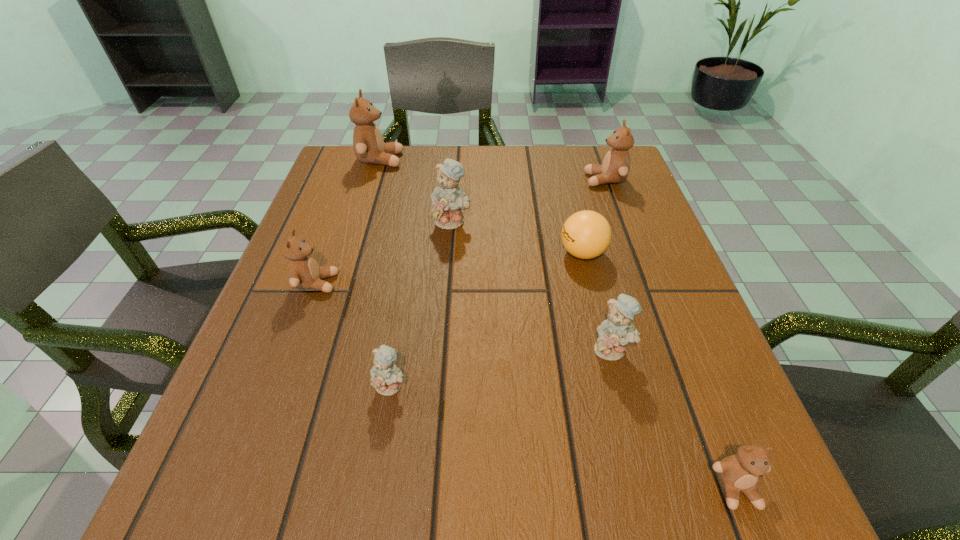
Identify which brown teddy bear is the second nearest to the second nearest brown teddy bear. Please provide its 2D coordinates. Your answer should be formatted as a tuple, i.e. [(x, y)], where the tuple contains the x and y coordinates of a point satisfying the conditions above.

[(615, 168)]

Where is `blue teddy bear that is the third closest to the third smallest brown teddy bear`? This screenshot has width=960, height=540. blue teddy bear that is the third closest to the third smallest brown teddy bear is located at coordinates (386, 377).

Where is `blue teddy bear that is the closest to the rightmost blue teddy bear`? This screenshot has height=540, width=960. blue teddy bear that is the closest to the rightmost blue teddy bear is located at coordinates (386, 377).

You are a GUI agent. You are given a task and a screenshot of the screen. Output one action in this format:
    pyautogui.click(x=<x>, y=<y>)
    Task: Click on the vacant region that satisfies the following two spatial constraints: 1. on the front-facing side of the third smallest brown teddy bear; 2. on the front-facing side of the seventh farthest object
    The width and height of the screenshot is (960, 540).
    Given the screenshot: What is the action you would take?
    pyautogui.click(x=680, y=386)

Where is `free space in the image that satisfies the following two spatial constraints: 1. on the front-facing side of the second biggest brown teddy bear; 2. on the front-facing side of the nearest blue teddy bear`? The height and width of the screenshot is (540, 960). free space in the image that satisfies the following two spatial constraints: 1. on the front-facing side of the second biggest brown teddy bear; 2. on the front-facing side of the nearest blue teddy bear is located at coordinates (680, 386).

Locate an element on the screen. The image size is (960, 540). blank space that satisfies the following two spatial constraints: 1. on the front-facing side of the second biggest brown teddy bear; 2. on the front-facing side of the fifth teddy bear from left to right is located at coordinates (x=666, y=349).

Locate an element on the screen. The image size is (960, 540). free point that satisfies the following two spatial constraints: 1. on the front-facing side of the fifth object from right to left; 2. on the front-facing side of the fourth farthest teddy bear is located at coordinates (447, 283).